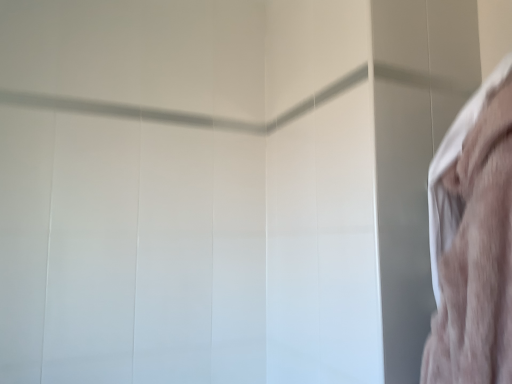
I want to click on fuzzy pink fabric at right, so click(x=475, y=243).

This screenshot has height=384, width=512. Describe the element at coordinates (475, 243) in the screenshot. I see `fuzzy pink fabric at right` at that location.

This screenshot has height=384, width=512. Identify the location of fuzzy pink fabric at right. [475, 243].